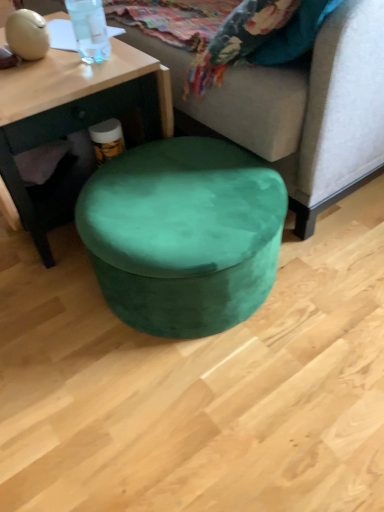
Where is `space that is in front of transparent plastic bottle at upper left`? Image resolution: width=384 pixels, height=512 pixels. space that is in front of transparent plastic bottle at upper left is located at coordinates (73, 81).